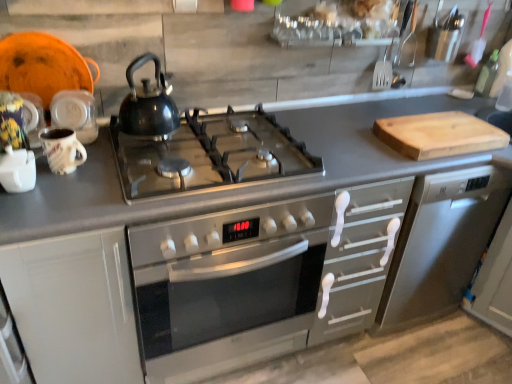
Question: Does green glass bottle at upper right have a greater height compared to glossy black kettle at center?

Choices:
 (A) yes
 (B) no

Answer: (B)

Question: Are green glass bottle at upper right and glossy black kettle at center beside each other?

Choices:
 (A) no
 (B) yes

Answer: (A)

Question: Considering the relative sizes of green glass bottle at upper right and glossy black kettle at center in the image provided, is green glass bottle at upper right thinner than glossy black kettle at center?

Choices:
 (A) yes
 (B) no

Answer: (A)

Question: Considering the relative sizes of green glass bottle at upper right and glossy black kettle at center in the image provided, is green glass bottle at upper right smaller than glossy black kettle at center?

Choices:
 (A) yes
 (B) no

Answer: (A)

Question: Considering the relative sizes of green glass bottle at upper right and glossy black kettle at center in the image provided, is green glass bottle at upper right shorter than glossy black kettle at center?

Choices:
 (A) yes
 (B) no

Answer: (A)

Question: From a real-world perspective, is glossy black kettle at center physically located above or below white matte cabinet at left?

Choices:
 (A) below
 (B) above

Answer: (B)

Question: Which is correct: glossy black kettle at center is inside white matte cabinet at left, or outside of it?

Choices:
 (A) outside
 (B) inside

Answer: (A)

Question: Visually, is glossy black kettle at center positioned to the left or to the right of white matte cabinet at left?

Choices:
 (A) right
 (B) left

Answer: (A)

Question: From the image's perspective, is glossy black kettle at center positioned above or below white matte cabinet at left?

Choices:
 (A) above
 (B) below

Answer: (A)

Question: Is point (492, 74) positioned closer to the camera than point (155, 132)?

Choices:
 (A) farther
 (B) closer

Answer: (A)

Question: From a real-world perspective, relative to glossy black kettle at center, is green glass bottle at upper right vertically above or below?

Choices:
 (A) above
 (B) below

Answer: (B)

Question: In the image, is green glass bottle at upper right positioned in front of or behind glossy black kettle at center?

Choices:
 (A) behind
 (B) front

Answer: (A)

Question: Is green glass bottle at upper right to the left or to the right of glossy black kettle at center in the image?

Choices:
 (A) right
 (B) left

Answer: (A)

Question: Is green glass bottle at upper right in front of or behind wooden cutting board at right in the image?

Choices:
 (A) front
 (B) behind

Answer: (B)

Question: Looking at their shapes, would you say green glass bottle at upper right is wider or thinner than wooden cutting board at right?

Choices:
 (A) wide
 (B) thin

Answer: (B)